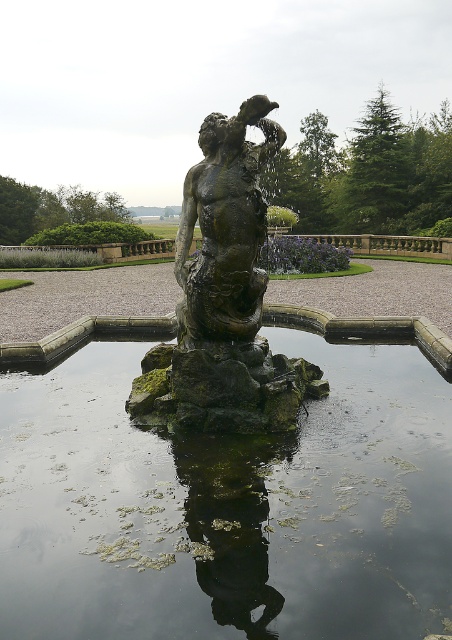
Can you confirm if green mossy statue at center is smaller than bronze statue at center?

Actually, green mossy statue at center might be larger than bronze statue at center.

Describe the element at coordinates (224, 298) in the screenshot. Image resolution: width=452 pixels, height=640 pixels. I see `green mossy statue at center` at that location.

Between point (287, 397) and point (216, 248), which one is positioned behind?

The point (287, 397) is behind.

Find the location of a particular element. The height and width of the screenshot is (640, 452). green mossy statue at center is located at coordinates point(224,298).

Is green mossy rock at center below bronze statue at center?

Indeed, green mossy rock at center is positioned under bronze statue at center.

Is green mossy rock at center closer to camera compared to bronze statue at center?

Yes.

What do you see at coordinates (227, 504) in the screenshot?
I see `green mossy rock at center` at bounding box center [227, 504].

The width and height of the screenshot is (452, 640). Identify the location of green mossy rock at center. (227, 504).

Can you confirm if green mossy rock at center is bigger than green mossy statue at center?

Yes.

Between green mossy rock at center and green mossy statue at center, which one appears on the left side from the viewer's perspective?

green mossy rock at center

What do you see at coordinates (227, 504) in the screenshot? The height and width of the screenshot is (640, 452). I see `green mossy rock at center` at bounding box center [227, 504].

What are the coordinates of `green mossy rock at center` in the screenshot? It's located at (227, 504).